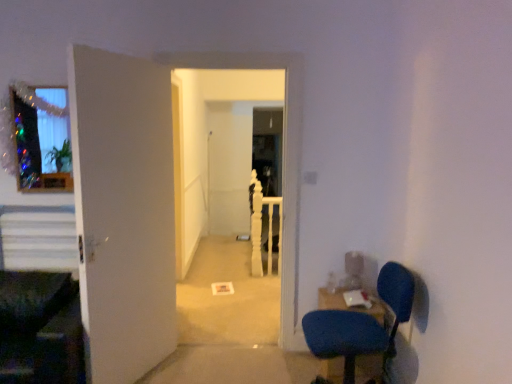
Question: Is blue fabric chair at lower right at the right side of white wooden rail at center?

Choices:
 (A) no
 (B) yes

Answer: (B)

Question: Considering the relative sizes of blue fabric chair at lower right and white wooden rail at center in the image provided, is blue fabric chair at lower right bigger than white wooden rail at center?

Choices:
 (A) no
 (B) yes

Answer: (B)

Question: From a real-world perspective, is blue fabric chair at lower right under white wooden rail at center?

Choices:
 (A) yes
 (B) no

Answer: (A)

Question: Does blue fabric chair at lower right have a greater width compared to white wooden rail at center?

Choices:
 (A) no
 (B) yes

Answer: (B)

Question: Is white wooden rail at center surrounded by blue fabric chair at lower right?

Choices:
 (A) yes
 (B) no

Answer: (B)

Question: Does point (141, 299) appear closer or farther from the camera than point (188, 109)?

Choices:
 (A) farther
 (B) closer

Answer: (B)

Question: In terms of height, does white matte door at left look taller or shorter compared to white matte carpet at center?

Choices:
 (A) tall
 (B) short

Answer: (B)

Question: Is white matte door at left in front of or behind white matte carpet at center in the image?

Choices:
 (A) behind
 (B) front

Answer: (B)

Question: Would you say white matte door at left is inside or outside white matte carpet at center?

Choices:
 (A) inside
 (B) outside

Answer: (B)

Question: From the image's perspective, is blue fabric chair at lower right located above or below white matte door at left?

Choices:
 (A) below
 (B) above

Answer: (A)

Question: Is point (377, 291) positioned closer to the camera than point (86, 71)?

Choices:
 (A) closer
 (B) farther

Answer: (B)

Question: Considering the relative positions of blue fabric chair at lower right and white matte door at left in the image provided, is blue fabric chair at lower right to the left or to the right of white matte door at left?

Choices:
 (A) left
 (B) right

Answer: (B)

Question: Based on their sizes in the image, would you say blue fabric chair at lower right is bigger or smaller than white matte door at left?

Choices:
 (A) big
 (B) small

Answer: (A)

Question: Considering the relative positions of white matte carpet at center and white wooden rail at center in the image provided, is white matte carpet at center to the left or to the right of white wooden rail at center?

Choices:
 (A) right
 (B) left

Answer: (B)

Question: Is white matte carpet at center situated inside white wooden rail at center or outside?

Choices:
 (A) inside
 (B) outside

Answer: (B)